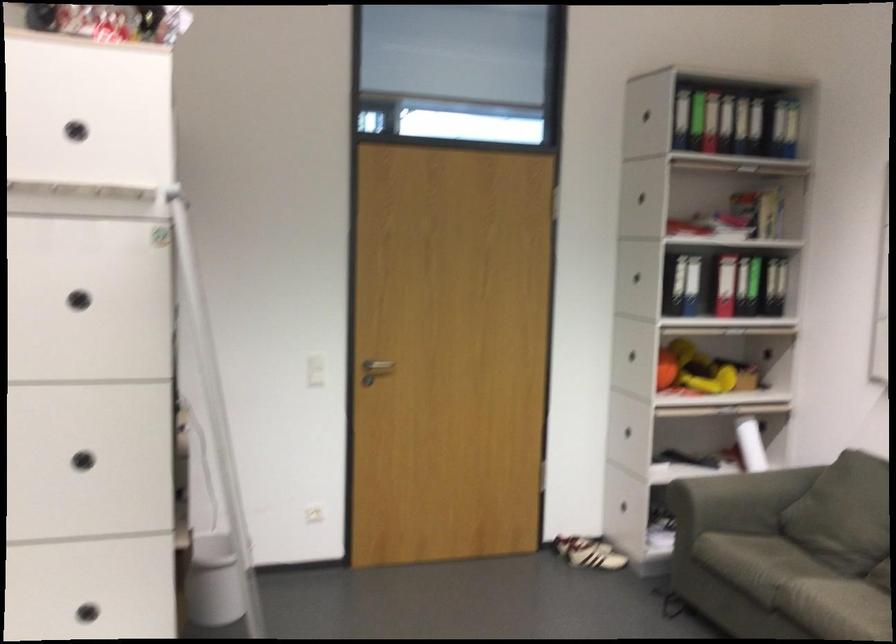
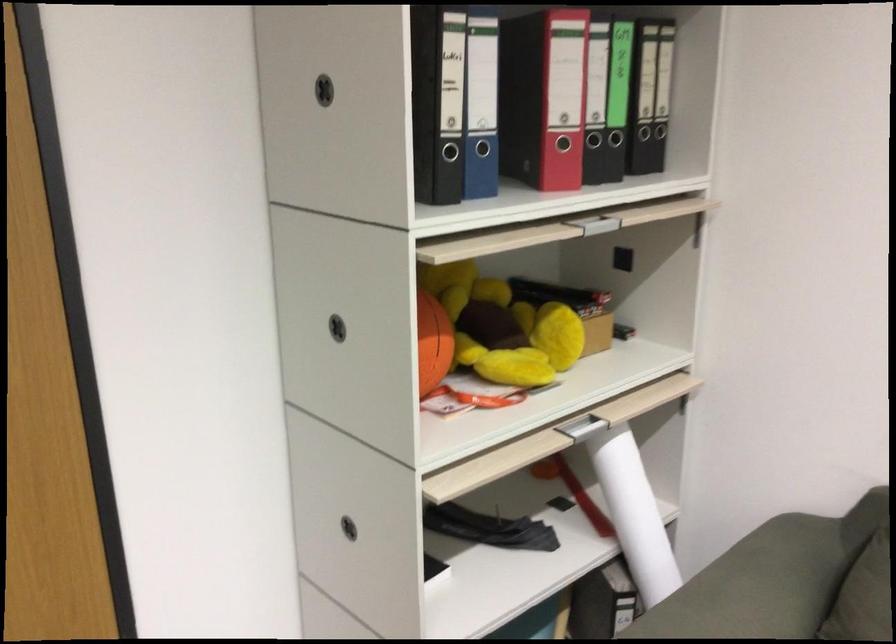
The point at [631,260] is marked in the first image. Where is the corresponding point in the second image?

(326, 86)